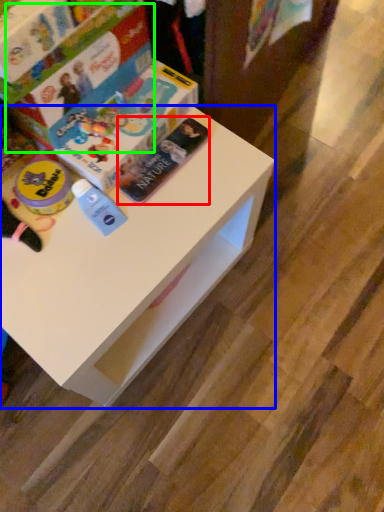
Question: Estimate the real-world distances between objects in this image. Which object is closer to paperback book (highlighted by a red box), table (highlighted by a blue box) or paperback book (highlighted by a green box)?

Choices:
 (A) table
 (B) paperback book

Answer: (B)